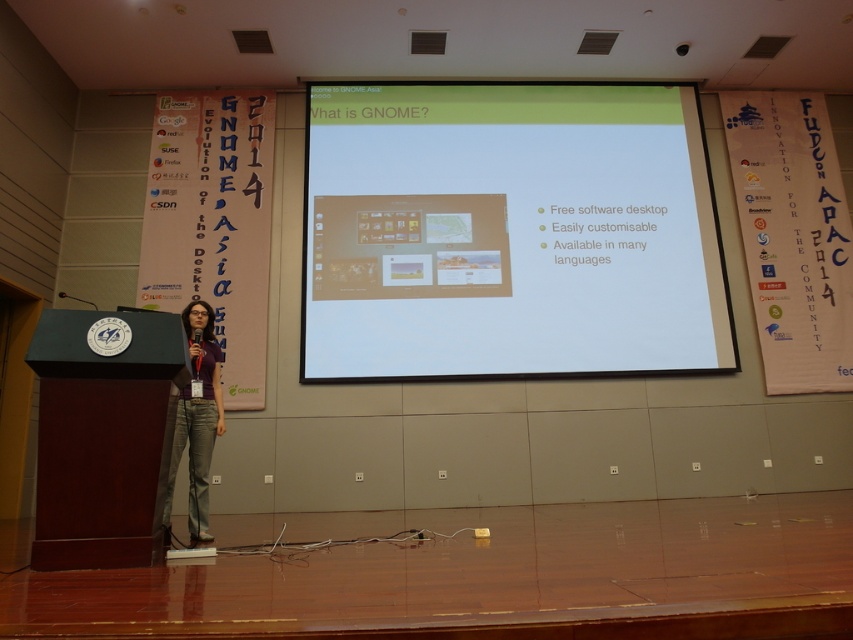
Question: Based on their relative distances, which object is nearer to the white matte projector screen at center?

Choices:
 (A) matte purple shirt at center
 (B) dark wood podium at center

Answer: (A)

Question: Is dark wood podium at center smaller than matte purple shirt at center?

Choices:
 (A) yes
 (B) no

Answer: (A)

Question: Among these points, which one is farthest from the camera?

Choices:
 (A) (62, 369)
 (B) (189, 324)

Answer: (B)

Question: Considering the real-world distances, which object is closest to the dark wood podium at center?

Choices:
 (A) white matte projector screen at center
 (B) matte purple shirt at center

Answer: (B)

Question: Is dark wood podium at center wider than matte purple shirt at center?

Choices:
 (A) yes
 (B) no

Answer: (A)

Question: Is dark wood podium at center below matte purple shirt at center?

Choices:
 (A) no
 (B) yes

Answer: (B)